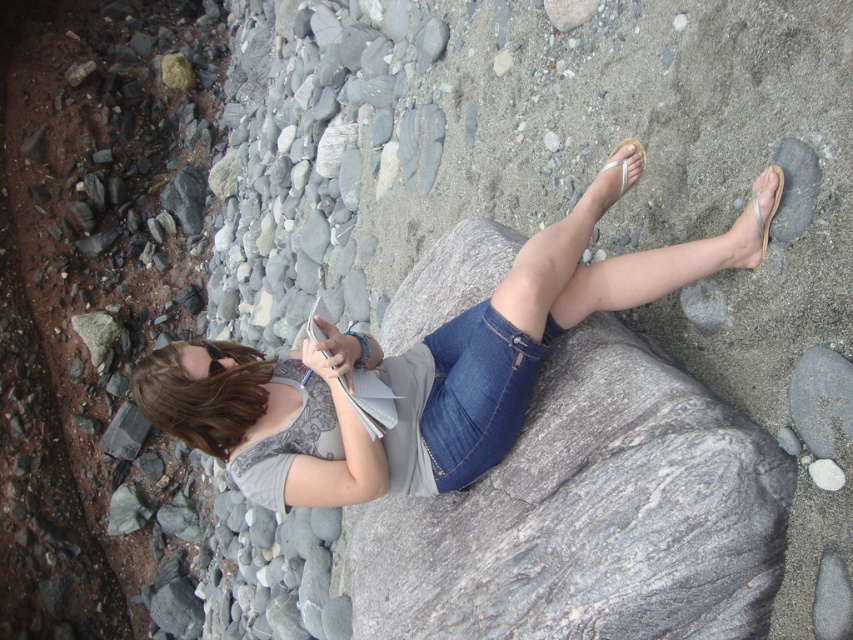
You are standing at the origin point in the image and want to walk towards the person sitting on the large gray rock. Which point, point [469,636] or point [453,480], is closer to your path?

Point [469,636] is in front of point [453,480], so it is closer to your path towards the person sitting on the large gray rock.